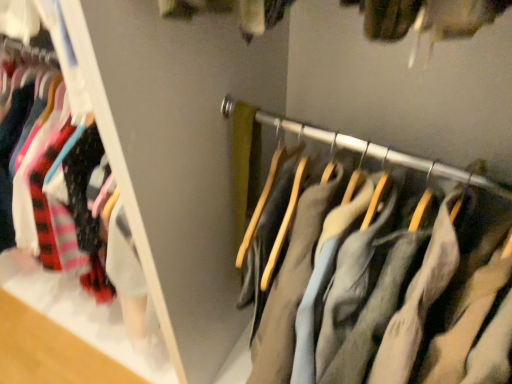
What is the approximate width of light gray cotton pants at center?

light gray cotton pants at center is 19.34 inches in width.

Describe the element at coordinates (375, 280) in the screenshot. I see `light gray cotton pants at center` at that location.

At what (x,y) coordinates should I click in order to perform the action: click on light gray cotton pants at center. Please return your answer as a coordinate pair (x, y). Looking at the image, I should click on (375, 280).

Identify the location of matte black hangers at left. This screenshot has width=512, height=384. (53, 44).

This screenshot has width=512, height=384. Describe the element at coordinates (53, 44) in the screenshot. I see `matte black hangers at left` at that location.

I want to click on light gray cotton pants at center, so click(375, 280).

Can you confirm if light gray cotton pants at center is positioned to the right of matte black hangers at left?

Correct, you'll find light gray cotton pants at center to the right of matte black hangers at left.

Considering the positions of objects light gray cotton pants at center and matte black hangers at left in the image provided, who is behind, light gray cotton pants at center or matte black hangers at left?

matte black hangers at left.

Is point (387, 234) closer or farther from the camera than point (82, 77)?

Clearly, point (387, 234) is more distant from the camera than point (82, 77).

From the image's perspective, is light gray cotton pants at center on matte black hangers at left?

No.

Based on the photo, from a real-world perspective, is light gray cotton pants at center physically located above or below matte black hangers at left?

light gray cotton pants at center is situated lower than matte black hangers at left in the real world.

Which object is wider, light gray cotton pants at center or matte black hangers at left?

Wider between the two is light gray cotton pants at center.

Can you confirm if light gray cotton pants at center is shorter than matte black hangers at left?

Indeed, light gray cotton pants at center has a lesser height compared to matte black hangers at left.

Looking at the image, does light gray cotton pants at center seem bigger or smaller compared to matte black hangers at left?

Considering their sizes, light gray cotton pants at center takes up less space than matte black hangers at left.

Is light gray cotton pants at center not within matte black hangers at left?

That's correct, light gray cotton pants at center is outside of matte black hangers at left.

Is the surface of light gray cotton pants at center in direct contact with matte black hangers at left?

No, light gray cotton pants at center is not in contact with matte black hangers at left.

From the picture: Is matte black hangers at left at the back of light gray cotton pants at center?

A: No.

How different are the orientations of light gray cotton pants at center and matte black hangers at left in degrees?

They differ by 0.484 degrees in their facing directions.

The height and width of the screenshot is (384, 512). There is a light gray cotton pants at center. Identify the location of closet above it (from a real-world perspective). (53, 44).

Which is more to the left, matte black hangers at left or light gray cotton pants at center?

matte black hangers at left is more to the left.

Which is behind, matte black hangers at left or light gray cotton pants at center?

matte black hangers at left is behind.

Which is closer, (x=168, y=360) or (x=455, y=205)?

The point (x=455, y=205) is closer to the camera.

From the image's perspective, which one is positioned higher, matte black hangers at left or light gray cotton pants at center?

matte black hangers at left.

From a real-world perspective, which object stands above the other?

From a 3D spatial view, matte black hangers at left is above.

Does matte black hangers at left have a greater width compared to light gray cotton pants at center?

In fact, matte black hangers at left might be narrower than light gray cotton pants at center.

Considering the sizes of objects matte black hangers at left and light gray cotton pants at center in the image provided, who is taller, matte black hangers at left or light gray cotton pants at center?

With more height is matte black hangers at left.

Considering the relative sizes of matte black hangers at left and light gray cotton pants at center in the image provided, is matte black hangers at left bigger than light gray cotton pants at center?

Yes.

Is matte black hangers at left situated inside light gray cotton pants at center or outside?

matte black hangers at left is located beyond the bounds of light gray cotton pants at center.

Based on the photo, are matte black hangers at left and light gray cotton pants at center beside each other?

No, matte black hangers at left is not with light gray cotton pants at center.

Is matte black hangers at left oriented towards light gray cotton pants at center?

No, matte black hangers at left is not oriented towards light gray cotton pants at center.

What's the angular difference between matte black hangers at left and light gray cotton pants at center's facing directions?

The facing directions of matte black hangers at left and light gray cotton pants at center are 0.484 degrees apart.

Consider the image. How far apart are matte black hangers at left and light gray cotton pants at center?

matte black hangers at left and light gray cotton pants at center are 21.96 inches apart from each other.

Image resolution: width=512 pixels, height=384 pixels. Find the location of `closet lying behind the light gray cotton pants at center`. closet lying behind the light gray cotton pants at center is located at coordinates (53, 44).

Where is `closet that appears above the light gray cotton pants at center (from a real-world perspective)`? closet that appears above the light gray cotton pants at center (from a real-world perspective) is located at coordinates (53, 44).

In order to click on closet behind the light gray cotton pants at center in this screenshot , I will do (53, 44).